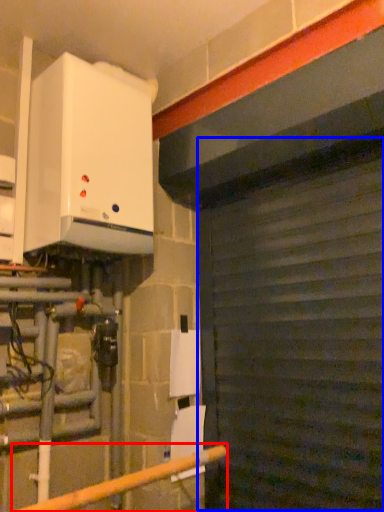
Question: Which of the following is the closest to the observer, rail (highlighted by a red box) or garage door (highlighted by a blue box)?

Choices:
 (A) rail
 (B) garage door

Answer: (A)